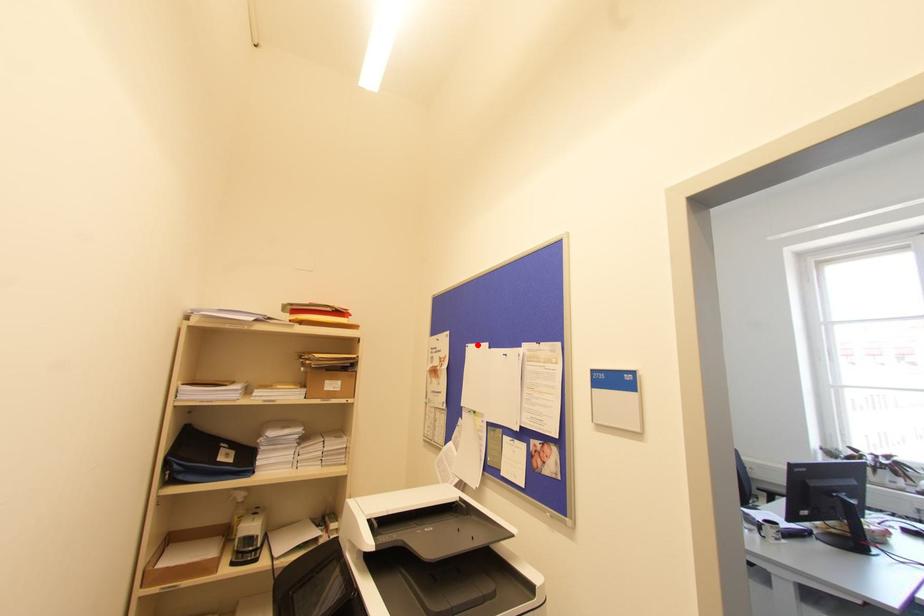
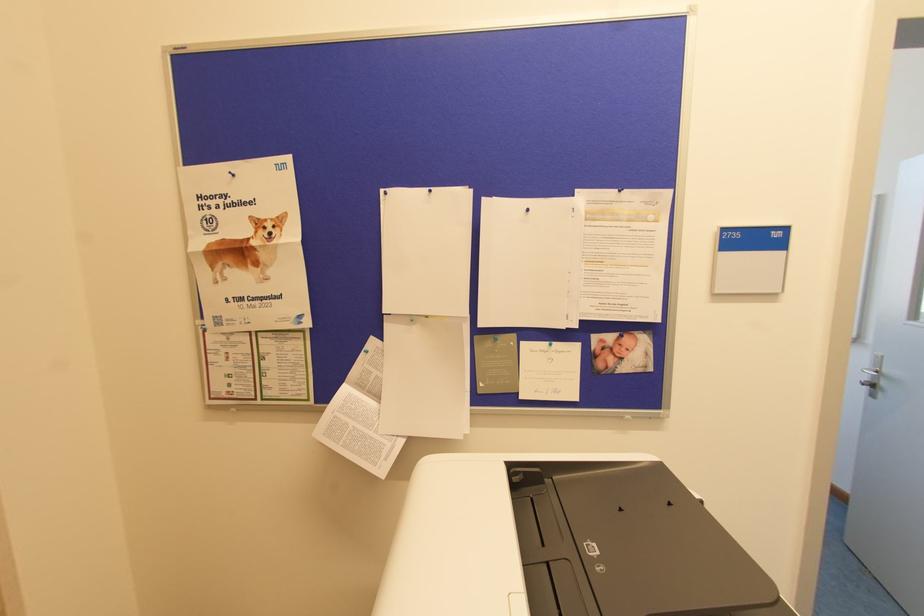
Locate, in the second image, the point that corresponds to the highlighted location in the first image.

(430, 191)